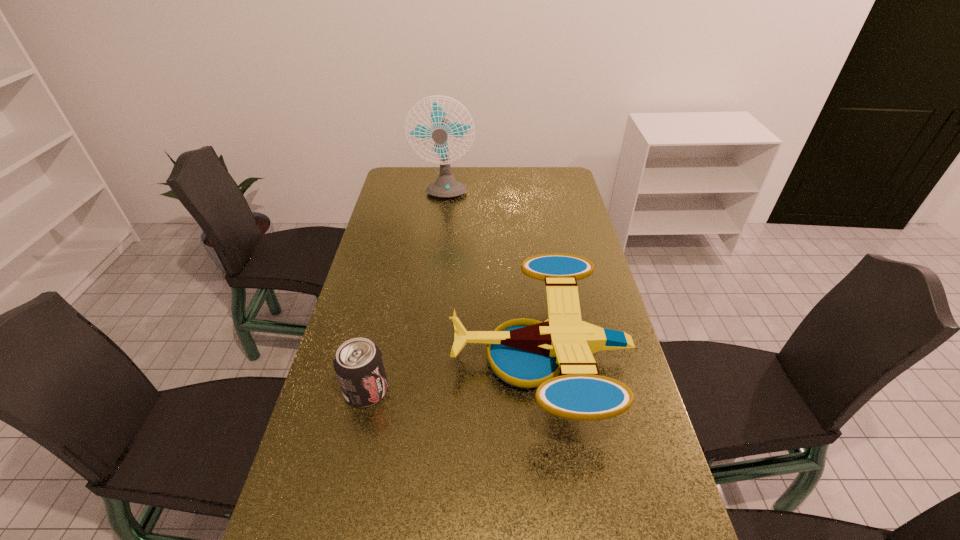
Identify the location of vacant area between the soda can and the fan. [x=405, y=293].

Where is `unoccupied position between the soda can and the tallest object`? unoccupied position between the soda can and the tallest object is located at coordinates (405, 293).

Identify which object is the closest to the drone. Please provide its 2D coordinates. Your answer should be formatted as a tuple, i.e. [(x, y)], where the tuple contains the x and y coordinates of a point satisfying the conditions above.

[(358, 363)]

Identify the location of the second closest object to the soda can. (446, 186).